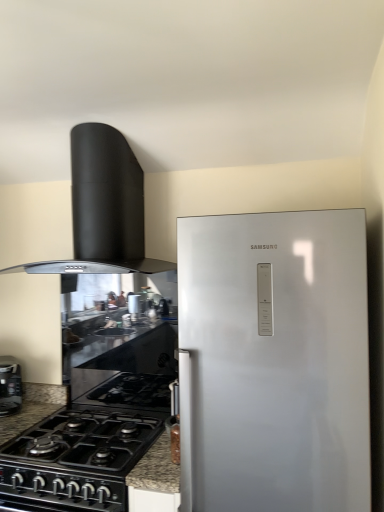
Question: Is black glossy toaster at lower left smaller than black glass countertop at center?

Choices:
 (A) yes
 (B) no

Answer: (A)

Question: From a real-world perspective, is black glossy toaster at lower left over black glass countertop at center?

Choices:
 (A) no
 (B) yes

Answer: (A)

Question: Is black glossy toaster at lower left further to the viewer compared to black glass countertop at center?

Choices:
 (A) no
 (B) yes

Answer: (A)

Question: From a real-world perspective, is black glossy toaster at lower left located beneath black glass countertop at center?

Choices:
 (A) no
 (B) yes

Answer: (B)

Question: Can you confirm if black glossy toaster at lower left is taller than black glass countertop at center?

Choices:
 (A) no
 (B) yes

Answer: (A)

Question: Is black glossy toaster at lower left next to black glass countertop at center?

Choices:
 (A) no
 (B) yes

Answer: (A)

Question: Is black matte range hood at upper left surrounded by black glass countertop at center?

Choices:
 (A) yes
 (B) no

Answer: (B)

Question: Is black glass countertop at center looking in the opposite direction of black matte range hood at upper left?

Choices:
 (A) no
 (B) yes

Answer: (A)

Question: Considering the relative sizes of black glass countertop at center and black matte range hood at upper left in the image provided, is black glass countertop at center bigger than black matte range hood at upper left?

Choices:
 (A) yes
 (B) no

Answer: (B)

Question: Are black glass countertop at center and black matte range hood at upper left located far from each other?

Choices:
 (A) no
 (B) yes

Answer: (A)

Question: Can you confirm if black glass countertop at center is wider than black matte range hood at upper left?

Choices:
 (A) yes
 (B) no

Answer: (B)

Question: Considering the relative sizes of black glass countertop at center and black matte range hood at upper left in the image provided, is black glass countertop at center smaller than black matte range hood at upper left?

Choices:
 (A) no
 (B) yes

Answer: (B)

Question: Does black glass countertop at center appear on the left side of black matte/glossy gas stove at lower left?

Choices:
 (A) no
 (B) yes

Answer: (A)